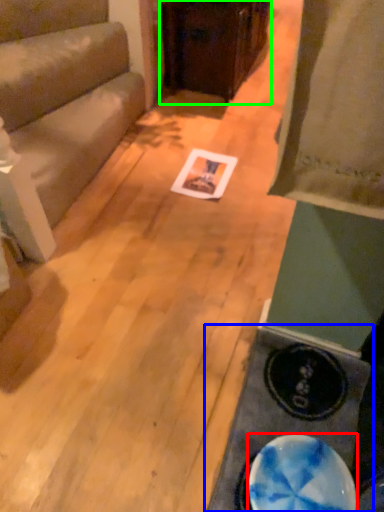
Question: Considering the real-world distances, which object is closest to plate (highlighted by a red box)? table (highlighted by a blue box) or furniture (highlighted by a green box).

Choices:
 (A) table
 (B) furniture

Answer: (A)